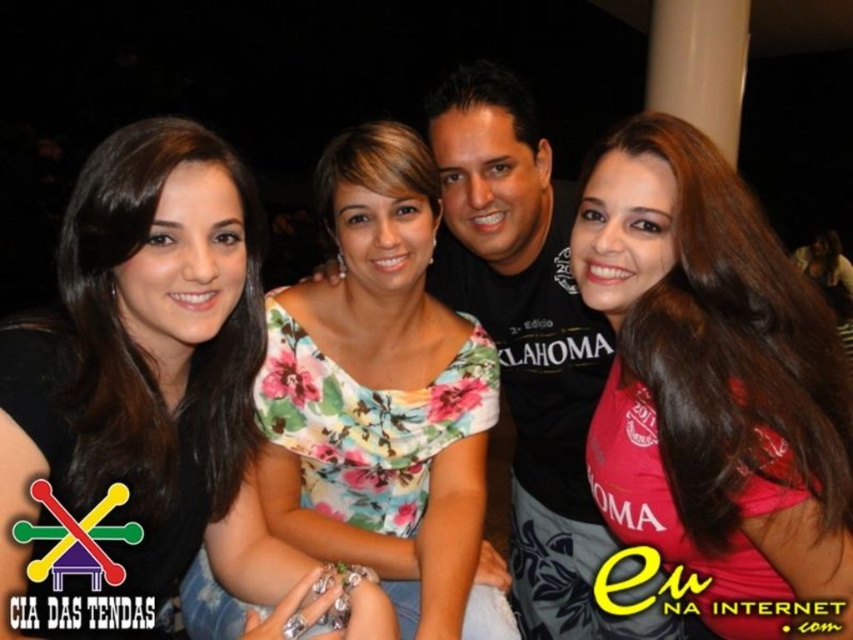
You are organizing a charity clothing drive and need to determine which items can fit into a donation box. The donation box can only accommodate items smaller than the pink jersey at right. Based on the image, can the floral fabric dress at upper center be placed into the donation box?

The floral fabric dress at upper center is bigger than the pink jersey at right, so it cannot be placed into the donation box since it exceeds the size limit.

You are a photographer at the event and want to ensure that both the floral fabric dress at upper center and the floral fabric dress at center are clearly visible in the photo. Which dress should you focus on first to ensure depth of field captures both?

You should focus on the floral fabric dress at center first because it is closer to the camera than the floral fabric dress at upper center, which is positioned behind it. By focusing on the closer dress, the depth of field will likely include the one behind it as well.